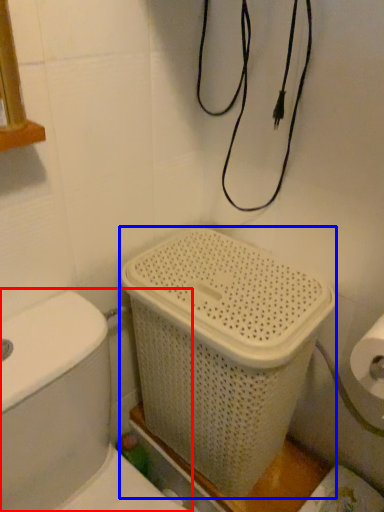
Question: Which object is further to the camera taking this photo, toilet (highlighted by a red box) or basket container (highlighted by a blue box)?

Choices:
 (A) toilet
 (B) basket container

Answer: (B)